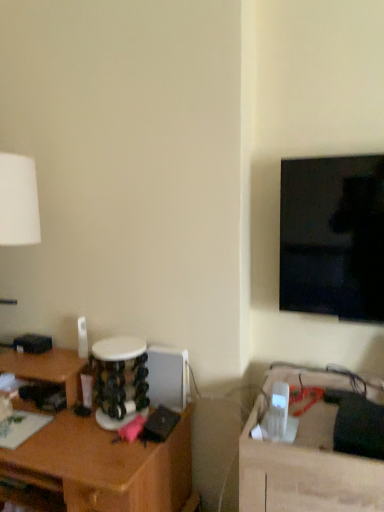
Question: Is point (289, 472) closer or farther from the camera than point (355, 318)?

Choices:
 (A) closer
 (B) farther

Answer: (A)

Question: From the image's perspective, is wooden table at lower right positioned above or below black glossy tv at upper right?

Choices:
 (A) above
 (B) below

Answer: (B)

Question: Which object is the farthest from the black glossy tv at upper right?

Choices:
 (A) brown wood desk at left
 (B) wooden table at lower right

Answer: (A)

Question: Which object is the farthest from the wooden table at lower right?

Choices:
 (A) black glossy tv at upper right
 (B) brown wood desk at left

Answer: (B)